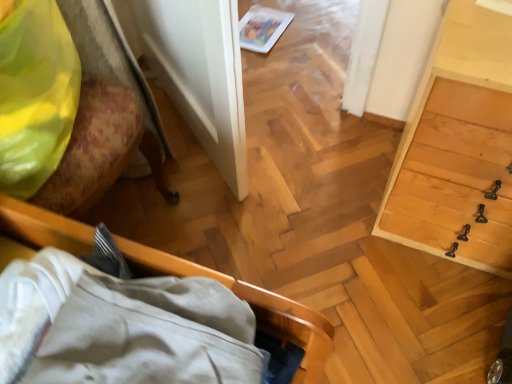
Question: From a real-world perspective, is white glossy magazine at upper center on wooden bed frame at lower left, the second furniture in the left-to-right sequence?

Choices:
 (A) yes
 (B) no

Answer: (B)

Question: Considering the relative sizes of white glossy magazine at upper center and wooden bed frame at lower left, the second furniture in the left-to-right sequence, in the image provided, is white glossy magazine at upper center bigger than wooden bed frame at lower left, the second furniture in the left-to-right sequence,?

Choices:
 (A) no
 (B) yes

Answer: (A)

Question: Would you say white glossy magazine at upper center is a long distance from wooden bed frame at lower left, which ranks as the first furniture in right-to-left order?

Choices:
 (A) no
 (B) yes

Answer: (B)

Question: Considering the relative positions of white glossy magazine at upper center and wooden bed frame at lower left, the second furniture in the left-to-right sequence, in the image provided, is white glossy magazine at upper center to the right of wooden bed frame at lower left, the second furniture in the left-to-right sequence, from the viewer's perspective?

Choices:
 (A) no
 (B) yes

Answer: (B)

Question: Does white glossy magazine at upper center have a lesser width compared to wooden bed frame at lower left, which ranks as the first furniture in right-to-left order?

Choices:
 (A) no
 (B) yes

Answer: (B)

Question: Is point (262, 41) positioned closer to the camera than point (411, 210)?

Choices:
 (A) closer
 (B) farther

Answer: (B)

Question: Based on their sizes in the image, would you say white glossy magazine at upper center is bigger or smaller than light wood dresser at right?

Choices:
 (A) small
 (B) big

Answer: (A)

Question: From their relative heights in the image, would you say white glossy magazine at upper center is taller or shorter than light wood dresser at right?

Choices:
 (A) short
 (B) tall

Answer: (A)

Question: Is white glossy magazine at upper center situated inside light wood dresser at right or outside?

Choices:
 (A) inside
 (B) outside

Answer: (B)

Question: Is wooden chair at left, positioned as the second furniture in right-to-left order, taller or shorter than light wood dresser at right?

Choices:
 (A) tall
 (B) short

Answer: (A)

Question: From a real-world perspective, is wooden chair at left, positioned as the second furniture in right-to-left order, physically located above or below light wood dresser at right?

Choices:
 (A) above
 (B) below

Answer: (A)

Question: Looking at their shapes, would you say wooden chair at left, positioned as the second furniture in right-to-left order, is wider or thinner than light wood dresser at right?

Choices:
 (A) thin
 (B) wide

Answer: (A)

Question: Do you think wooden chair at left, which is the first furniture in left-to-right order, is within light wood dresser at right, or outside of it?

Choices:
 (A) inside
 (B) outside

Answer: (B)

Question: Is wooden bed frame at lower left, which ranks as the first furniture in right-to-left order, wider or thinner than matte yellow fabric at upper left?

Choices:
 (A) thin
 (B) wide

Answer: (B)

Question: Based on their positions, is wooden bed frame at lower left, the second furniture in the left-to-right sequence, located to the left or right of matte yellow fabric at upper left?

Choices:
 (A) left
 (B) right

Answer: (B)